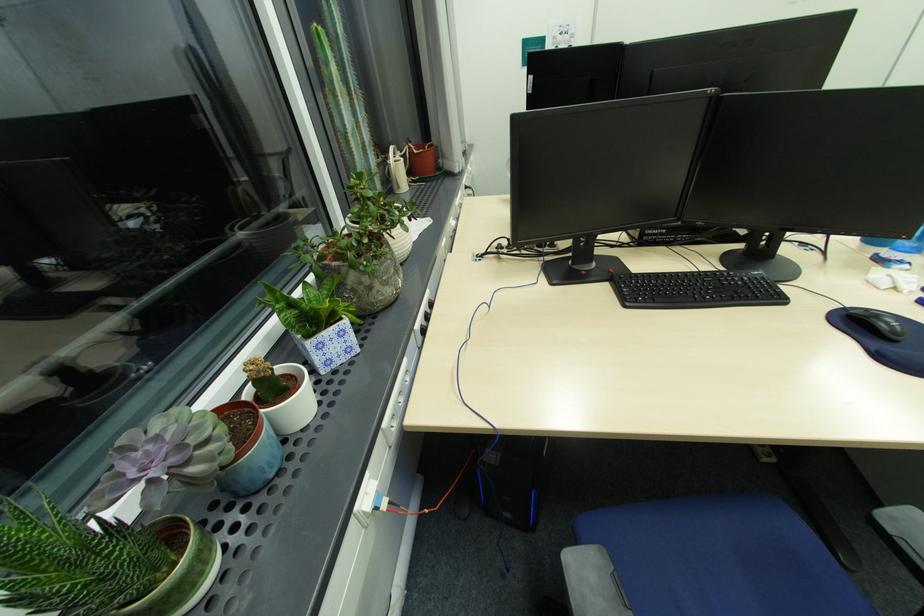
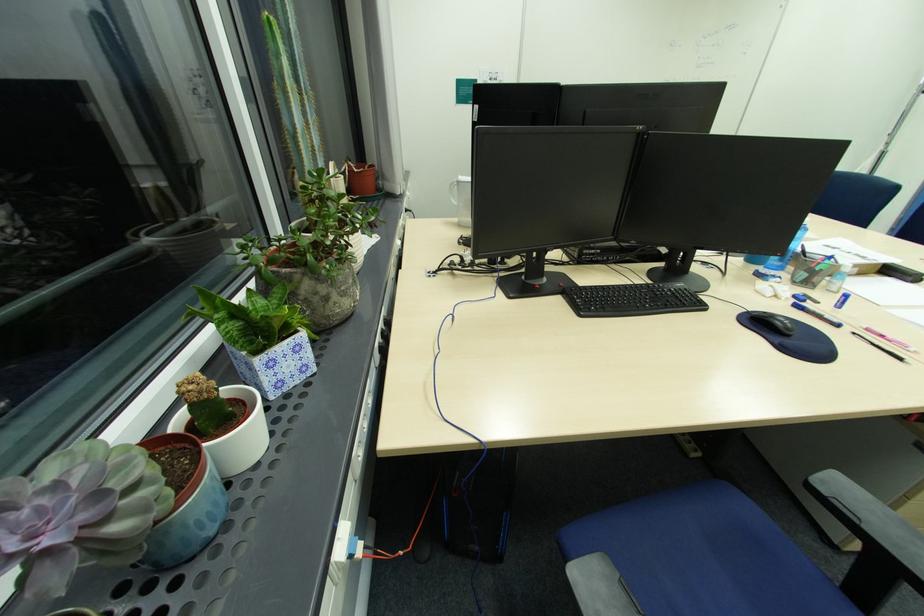
In a continuous first-person perspective shot, in which direction is the camera moving?

The movement direction of the cameraman is left, forward.